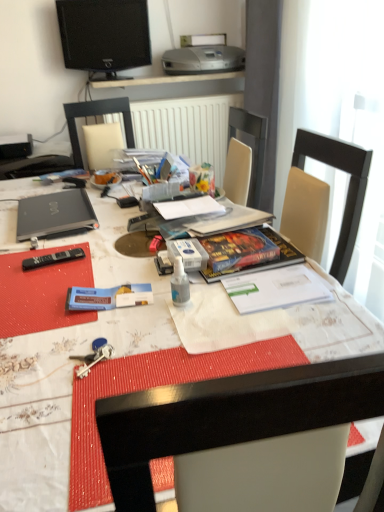
Locate an element on the screen. vacant space to the right of transparent plastic spray bottle at center is located at coordinates (245, 300).